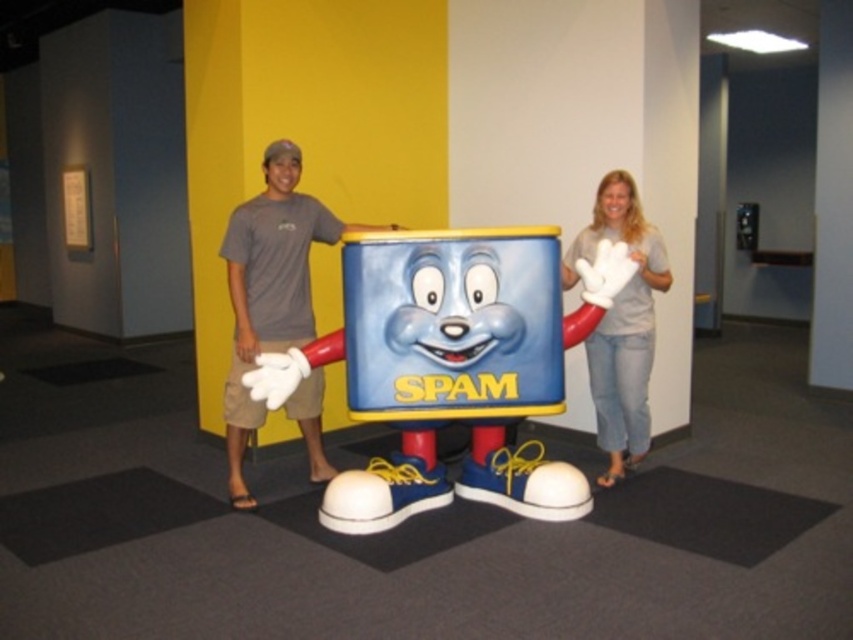
You are standing in the museum and want to take a photo of the matte plastic spam can at center. If your camera has a maximum focus range of 3 meters, will you be able to capture a clear photo without moving closer?

The matte plastic spam can at center is 3.72 meters away from the viewer. Since the camera can only focus up to 3 meters, you will not be able to capture a clear photo without moving closer.